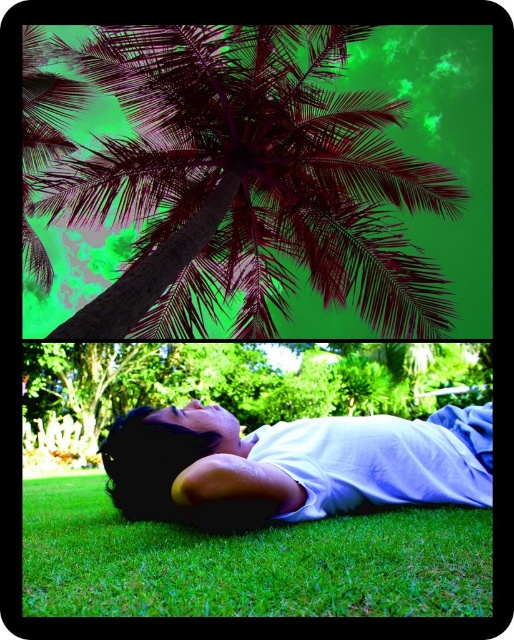
Question: Is green soft grass at lower center positioned before white cotton shirt at lower center?

Choices:
 (A) no
 (B) yes

Answer: (B)

Question: Observing the image, what is the correct spatial positioning of dark purple leafy coconut tree at upper center in reference to white cotton shirt at lower center?

Choices:
 (A) left
 (B) right

Answer: (A)

Question: Which object is farther from the camera taking this photo?

Choices:
 (A) dark purple leafy coconut tree at upper center
 (B) white cotton shirt at lower center
 (C) green leafy tree at center

Answer: (C)

Question: Among these points, which one is nearest to the camera?

Choices:
 (A) (284, 602)
 (B) (340, 380)

Answer: (A)

Question: Can you confirm if green soft grass at lower center is positioned above green leafy tree at center?

Choices:
 (A) no
 (B) yes

Answer: (B)

Question: Which point appears closest to the camera in this image?

Choices:
 (A) (233, 125)
 (B) (446, 600)
 (C) (318, 499)

Answer: (B)